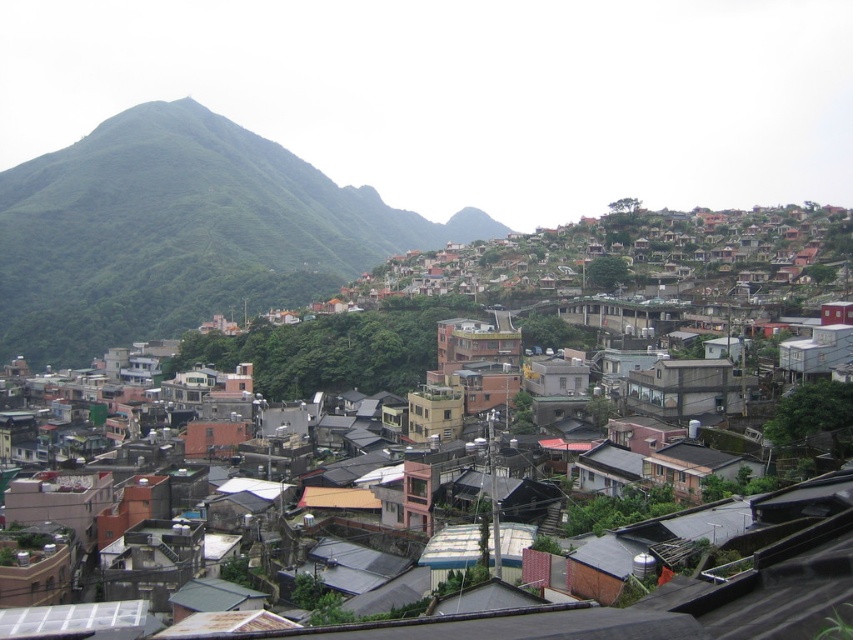
Question: Is green leafy mountain at upper left below matte gray buildings at center?

Choices:
 (A) yes
 (B) no

Answer: (B)

Question: Is green leafy mountain at upper left below matte gray buildings at center?

Choices:
 (A) yes
 (B) no

Answer: (B)

Question: Which object is farther from the camera taking this photo?

Choices:
 (A) green leafy mountain at upper left
 (B) matte gray buildings at center

Answer: (A)

Question: Is green leafy mountain at upper left below matte gray buildings at center?

Choices:
 (A) no
 (B) yes

Answer: (A)